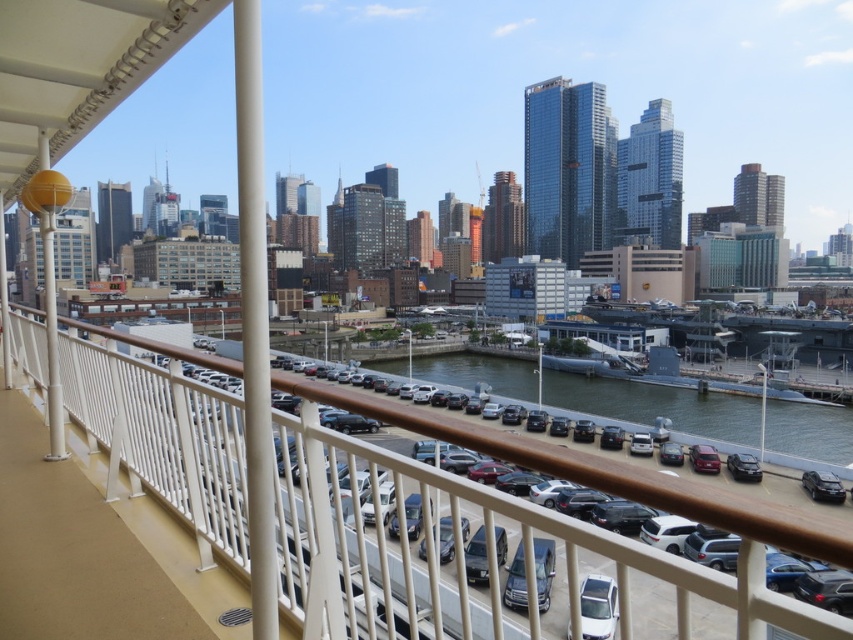
Question: Is white metal railing at center positioned before greenish water at lower center?

Choices:
 (A) yes
 (B) no

Answer: (A)

Question: Can you confirm if greenish water at lower center is positioned to the left of satin black sedan at center?

Choices:
 (A) yes
 (B) no

Answer: (B)

Question: Which point is farther to the camera?

Choices:
 (A) (671, 403)
 (B) (311, 467)
 (C) (751, 477)
 (D) (584, 579)

Answer: (A)

Question: Which object is farther from the camera taking this photo?

Choices:
 (A) shiny black sedan at lower right
 (B) white glossy car at center
 (C) white metal railing at center

Answer: (A)

Question: Is white metal railing at center smaller than white glossy car at center?

Choices:
 (A) no
 (B) yes

Answer: (A)

Question: Which of the following is the closest to the observer?

Choices:
 (A) (534, 566)
 (B) (218, 435)
 (C) (596, 588)
 (D) (750, 417)

Answer: (B)